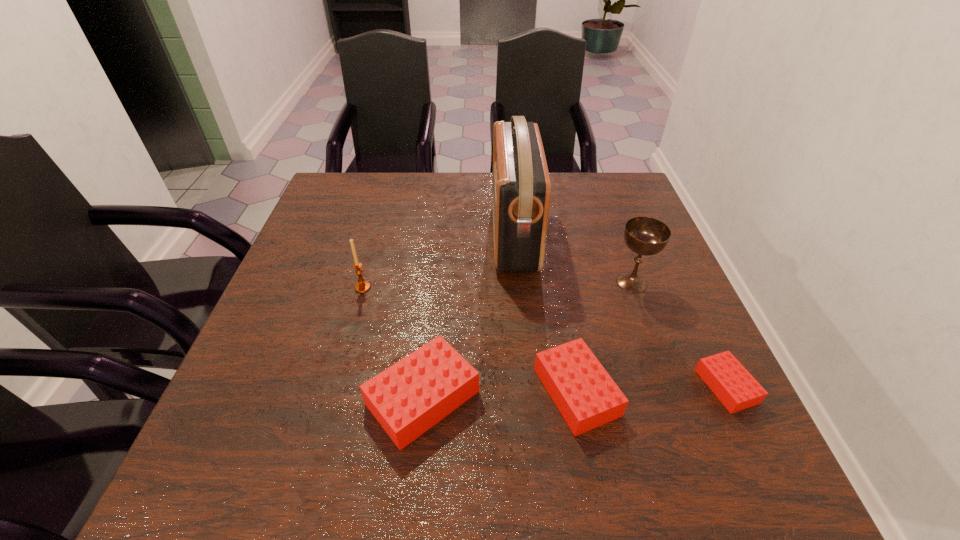
This screenshot has height=540, width=960. Find the location of `vacant space at the far edge of the desktop`. vacant space at the far edge of the desktop is located at coordinates (451, 197).

Identify the location of vacant area at the left edge. Image resolution: width=960 pixels, height=540 pixels. (330, 255).

Image resolution: width=960 pixels, height=540 pixels. In order to click on vacant space at the right edge of the desktop in this screenshot , I will do `click(610, 229)`.

The image size is (960, 540). In order to click on free space at the far left corner of the desktop in this screenshot , I will do `click(380, 181)`.

Where is `vacant region at the near left corner`? This screenshot has height=540, width=960. vacant region at the near left corner is located at coordinates (310, 399).

In the image, there is a desktop. Where is `vacant space at the far right corner`? Image resolution: width=960 pixels, height=540 pixels. vacant space at the far right corner is located at coordinates (611, 212).

This screenshot has width=960, height=540. In order to click on free space at the near right corner of the desktop in this screenshot , I will do `click(648, 392)`.

Where is `free space between the candle_holder and the rightmost Lego`? free space between the candle_holder and the rightmost Lego is located at coordinates (544, 337).

Find the location of a particular element. The height and width of the screenshot is (540, 960). vacant area between the candle_holder and the fifth object from left to right is located at coordinates (497, 285).

This screenshot has height=540, width=960. In order to click on free space that is in between the leftmost object and the leftmost Lego in this screenshot , I will do `click(393, 343)`.